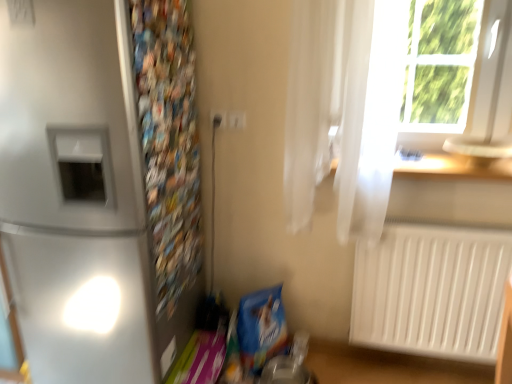
Question: Could you tell me if white plastic window frame at upper right is turned towards white plastic radiator at lower right?

Choices:
 (A) yes
 (B) no

Answer: (B)

Question: Is white plastic window frame at upper right not close to white plastic radiator at lower right?

Choices:
 (A) no
 (B) yes

Answer: (A)

Question: From the image's perspective, does white plastic window frame at upper right appear lower than white plastic radiator at lower right?

Choices:
 (A) yes
 (B) no

Answer: (B)

Question: Is white plastic window frame at upper right smaller than white plastic radiator at lower right?

Choices:
 (A) yes
 (B) no

Answer: (A)

Question: Does white plastic window frame at upper right lie behind white plastic radiator at lower right?

Choices:
 (A) yes
 (B) no

Answer: (B)

Question: Is satin silver refrigerator at left wider or thinner than wooden at upper right?

Choices:
 (A) thin
 (B) wide

Answer: (B)

Question: From a real-world perspective, is satin silver refrigerator at left positioned above or below wooden at upper right?

Choices:
 (A) below
 (B) above

Answer: (A)

Question: In the image, is satin silver refrigerator at left positioned in front of or behind wooden at upper right?

Choices:
 (A) front
 (B) behind

Answer: (A)

Question: Is satin silver refrigerator at left situated inside wooden at upper right or outside?

Choices:
 (A) inside
 (B) outside

Answer: (B)

Question: In the image, is white plastic window frame at upper right positioned in front of or behind white sheer curtain at upper right?

Choices:
 (A) behind
 (B) front

Answer: (A)

Question: Is white plastic window frame at upper right to the left or to the right of white sheer curtain at upper right in the image?

Choices:
 (A) left
 (B) right

Answer: (B)

Question: Is white plastic window frame at upper right bigger or smaller than white sheer curtain at upper right?

Choices:
 (A) big
 (B) small

Answer: (B)

Question: From a real-world perspective, is white plastic window frame at upper right positioned above or below white sheer curtain at upper right?

Choices:
 (A) below
 (B) above

Answer: (B)

Question: Considering the positions of white plastic electric outlet at upper center, which is counted as the first electric outlet, starting from the right, and satin silver refrigerator at left in the image, is white plastic electric outlet at upper center, which is counted as the first electric outlet, starting from the right, bigger or smaller than satin silver refrigerator at left?

Choices:
 (A) small
 (B) big

Answer: (A)

Question: Considering the positions of point (228, 127) and point (130, 375), is point (228, 127) closer or farther from the camera than point (130, 375)?

Choices:
 (A) farther
 (B) closer

Answer: (A)